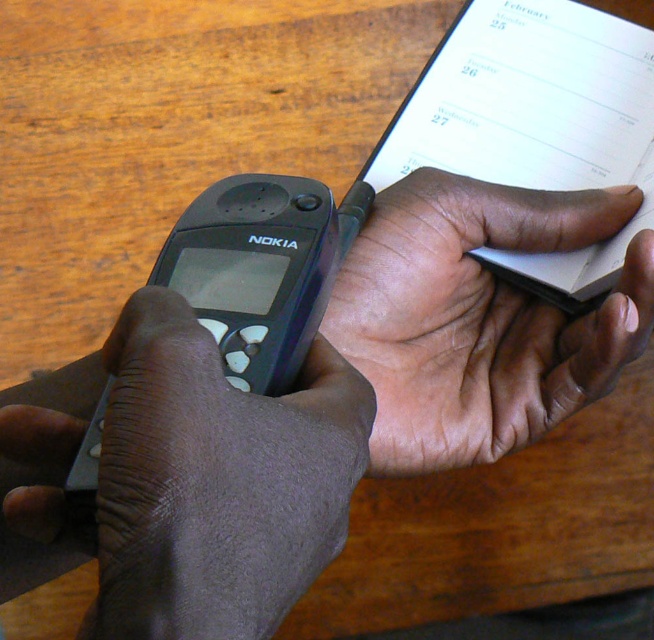
Question: Which object is positioned farthest from the white paper at upper right?

Choices:
 (A) matte black phone at center
 (B) matte plastic phone at lower left
 (C) smooth skin hand at center
 (D) black matte nokia phone at left

Answer: (B)

Question: Which object is the closest to the smooth skin hand at center?

Choices:
 (A) black matte nokia phone at left
 (B) matte plastic phone at lower left
 (C) white paper at upper right

Answer: (C)

Question: In this image, where is white paper at upper right located relative to black matte nokia phone at left?

Choices:
 (A) above
 (B) below

Answer: (A)

Question: Is matte plastic phone at lower left to the right of black matte nokia phone at left from the viewer's perspective?

Choices:
 (A) no
 (B) yes

Answer: (B)

Question: Can you confirm if matte black phone at center is positioned below matte plastic phone at lower left?

Choices:
 (A) no
 (B) yes

Answer: (A)

Question: Which point appears farthest from the camera in this image?

Choices:
 (A) (203, 422)
 (B) (215, 589)
 (C) (88, 474)
 (D) (532, 371)

Answer: (D)